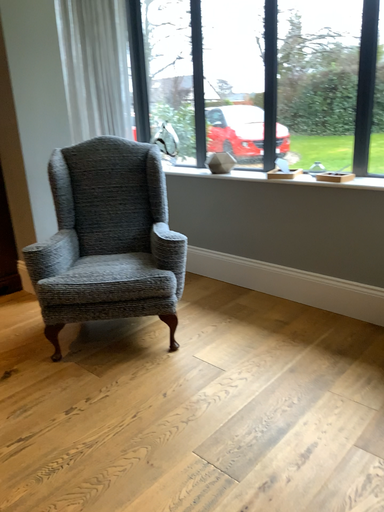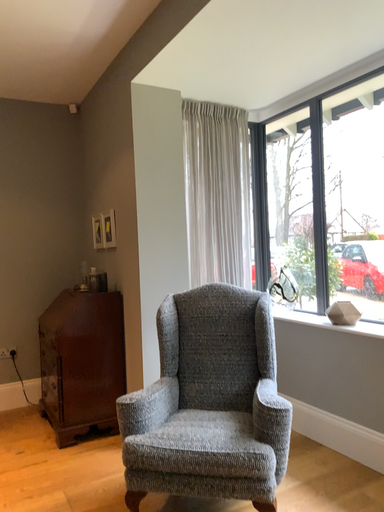
Question: How did the camera likely rotate when shooting the video?

Choices:
 (A) rotated upward
 (B) rotated downward

Answer: (A)